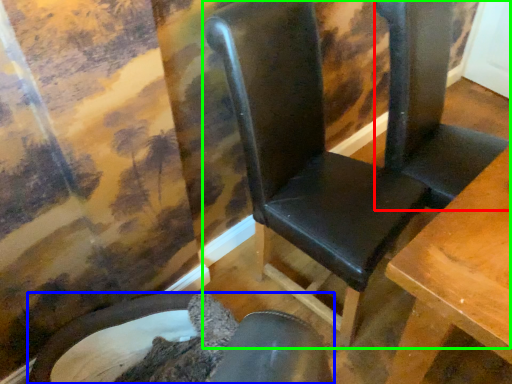
Question: Considering the real-world distances, which object is farthest from folding chair (highlighted by a red box)? chair (highlighted by a blue box) or chair (highlighted by a green box)?

Choices:
 (A) chair
 (B) chair

Answer: (A)